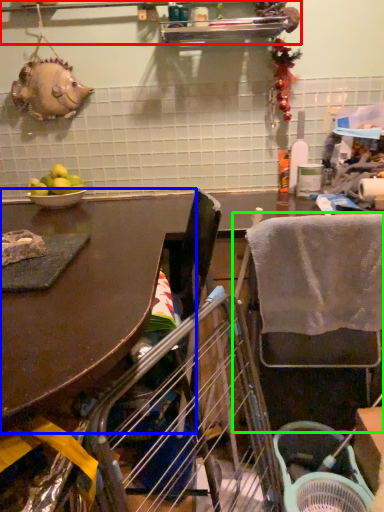
Question: Which object is positioned closest to shelf (highlighted by a red box)? Select from table (highlighted by a blue box) and chair (highlighted by a green box).

Choices:
 (A) table
 (B) chair

Answer: (A)